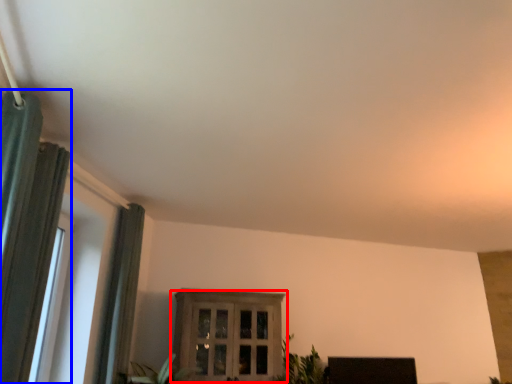
Question: Which object appears farthest to the camera in this image, window (highlighted by a red box) or curtain (highlighted by a blue box)?

Choices:
 (A) window
 (B) curtain

Answer: (A)